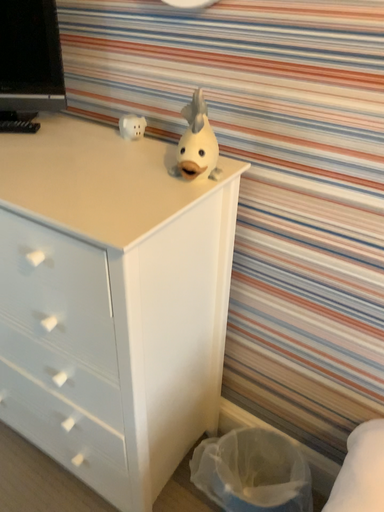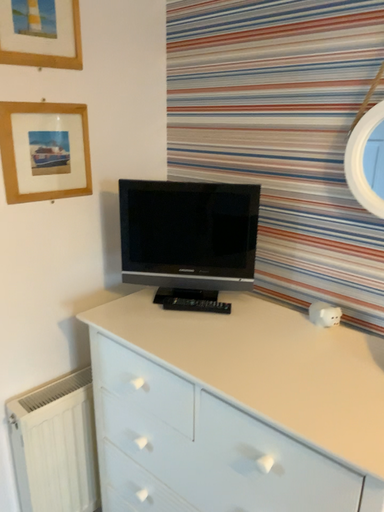
Question: Which way did the camera rotate in the video?

Choices:
 (A) rotated left
 (B) rotated right

Answer: (A)